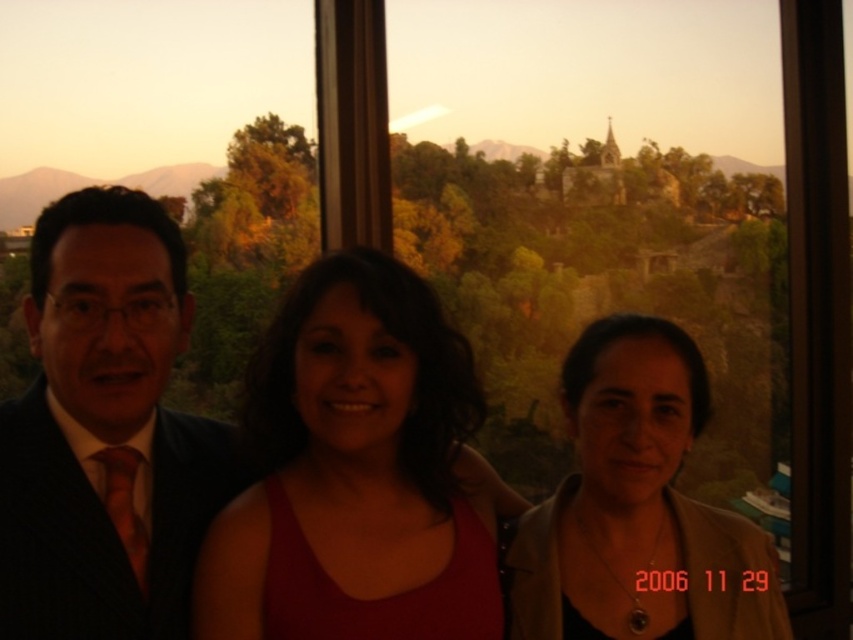
Question: Is matte black suit at left behind matte red tank top at center?

Choices:
 (A) yes
 (B) no

Answer: (B)

Question: Estimate the real-world distances between objects in this image. Which object is farther from the matte beige jacket at lower right?

Choices:
 (A) dark blue suit at left
 (B) matte black suit at left
 (C) matte red tank top at center

Answer: (A)

Question: Which object is farther from the camera taking this photo?

Choices:
 (A) matte black suit at left
 (B) dark blue suit at left

Answer: (A)

Question: Is matte red tank top at center closer to camera compared to matte beige jacket at lower right?

Choices:
 (A) yes
 (B) no

Answer: (A)

Question: Is matte red tank top at center positioned behind matte beige jacket at lower right?

Choices:
 (A) yes
 (B) no

Answer: (B)

Question: Which point appears closest to the camera in this image?

Choices:
 (A) (689, 518)
 (B) (49, 460)
 (C) (358, 481)
 (D) (688, 403)

Answer: (B)